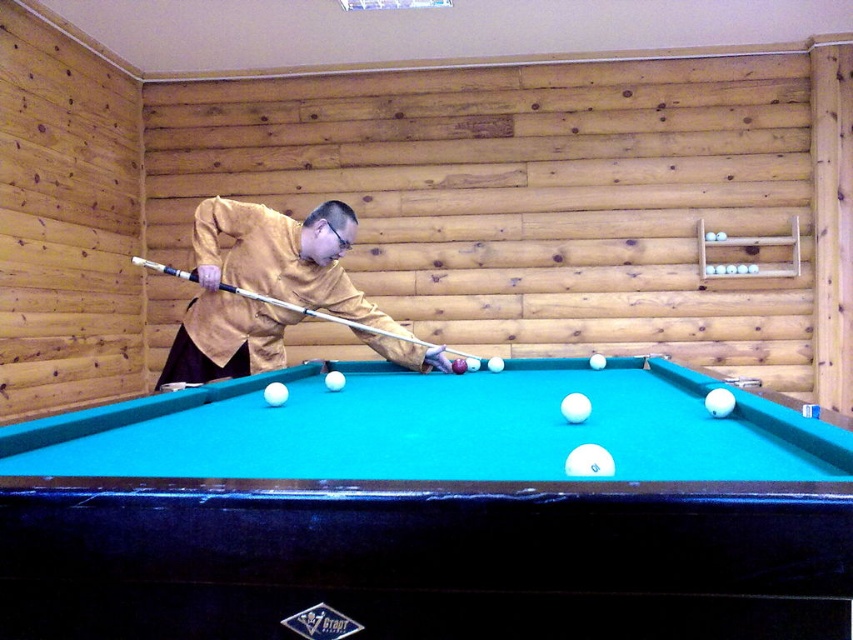
You are a pool ball that just got hit by the cue stick. You want to roll towards the teal felt billiard table at center and the matte yellow shirt at center. Which object is closer to you?

Both objects are at the center, so you are equidistant to both the teal felt billiard table at center and the matte yellow shirt at center.

You are standing in the room and want to place a new decorative item exactly at the center of the teal felt billiard table at center. According to the coordinates provided, where should you place it?

The teal felt billiard table at center is located at coordinates point (428, 509), so you should place the decorative item exactly at point (428, 509).